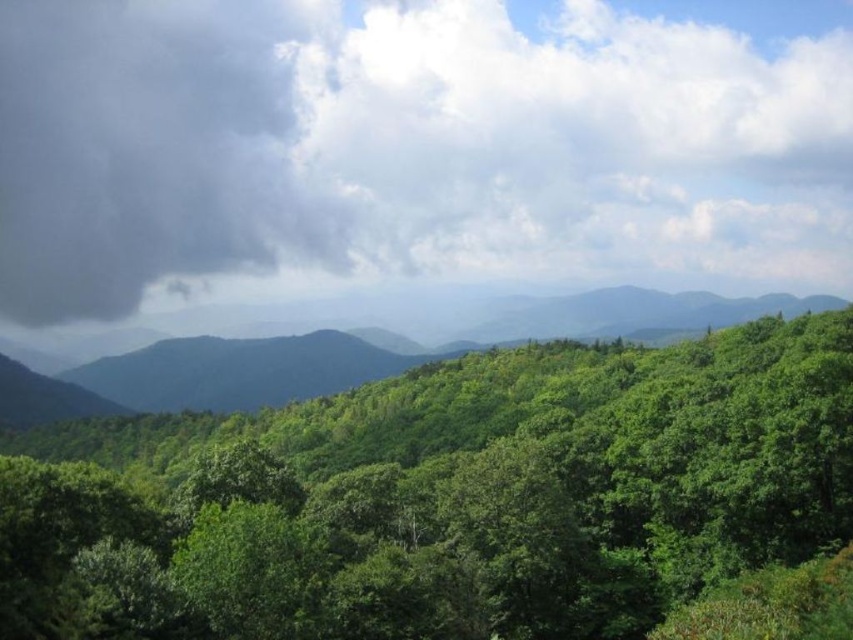
Question: Which is nearer to the green leafy tree at center?

Choices:
 (A) dark gray cloud at upper left
 (B) green leafy forest at center

Answer: (B)

Question: Which object is the closest to the green leafy tree at center?

Choices:
 (A) green leafy forest at center
 (B) dark gray cloud at upper left

Answer: (A)

Question: Which of the following is the farthest from the observer?

Choices:
 (A) (752, 460)
 (B) (439, 324)
 (C) (445, 28)

Answer: (C)

Question: Is dark gray cloud at upper left positioned in front of green leafy tree at center?

Choices:
 (A) yes
 (B) no

Answer: (B)

Question: From the image, what is the correct spatial relationship of dark gray cloud at upper left in relation to green leafy forest at center?

Choices:
 (A) left
 (B) right

Answer: (A)

Question: Can you confirm if dark gray cloud at upper left is positioned to the left of green leafy forest at center?

Choices:
 (A) no
 (B) yes

Answer: (B)